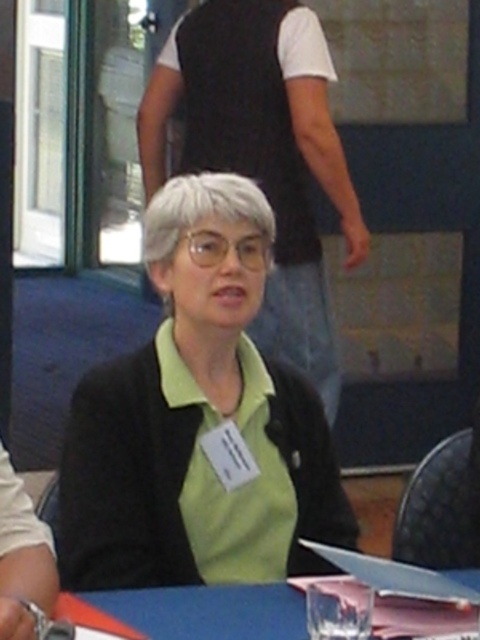
You are organizing a photo shoot and need to ensure that the green matte shirt at center and the blue fabric table at lower center are visible in the frame. Given their sizes, which object should you focus on first to ensure both are in the shot?

The green matte shirt at center is much taller than the blue fabric table at lower center, so you should focus on positioning the camera to include the taller green matte shirt at center first, ensuring the blue fabric table at lower center will naturally be within the frame due to its smaller size.

You are a security guard at a conference venue. You need to ensure that attendees maintain a minimum distance of 1.5 meters between each other for safety protocols. You observe the green matte shirt at center and the black vest at upper center. Can you confirm if they are complying with the distancing rules?

The green matte shirt at center is 1.48 meters away from the black vest at upper center, which is less than the required 1.5 meters. Therefore, they are not complying with the distancing rules.